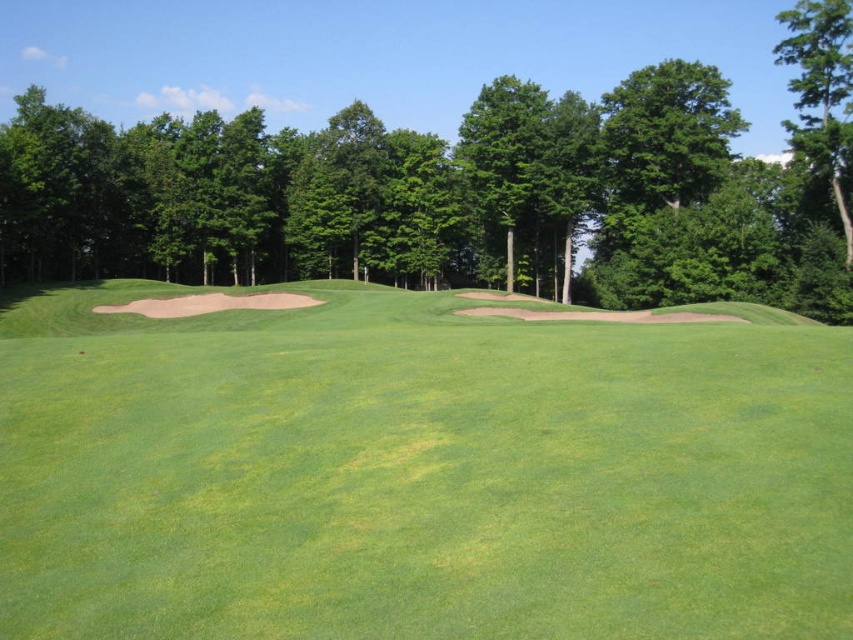
Question: Can you confirm if green grassy field at center is bigger than green leafy tree at center?

Choices:
 (A) yes
 (B) no

Answer: (B)

Question: Which object is the closest to the green grassy field at center?

Choices:
 (A) green leafy tree at center
 (B) green leafy tree at upper right

Answer: (A)

Question: Is green grassy field at center positioned at the back of green leafy tree at center?

Choices:
 (A) yes
 (B) no

Answer: (B)

Question: Based on their relative distances, which object is farther from the green leafy tree at upper right?

Choices:
 (A) green leafy tree at center
 (B) green grassy field at center

Answer: (B)

Question: Which object is the closest to the green grassy field at center?

Choices:
 (A) green leafy tree at center
 (B) green leafy tree at upper right

Answer: (A)

Question: Is the position of green leafy tree at center more distant than that of green leafy tree at upper right?

Choices:
 (A) no
 (B) yes

Answer: (A)